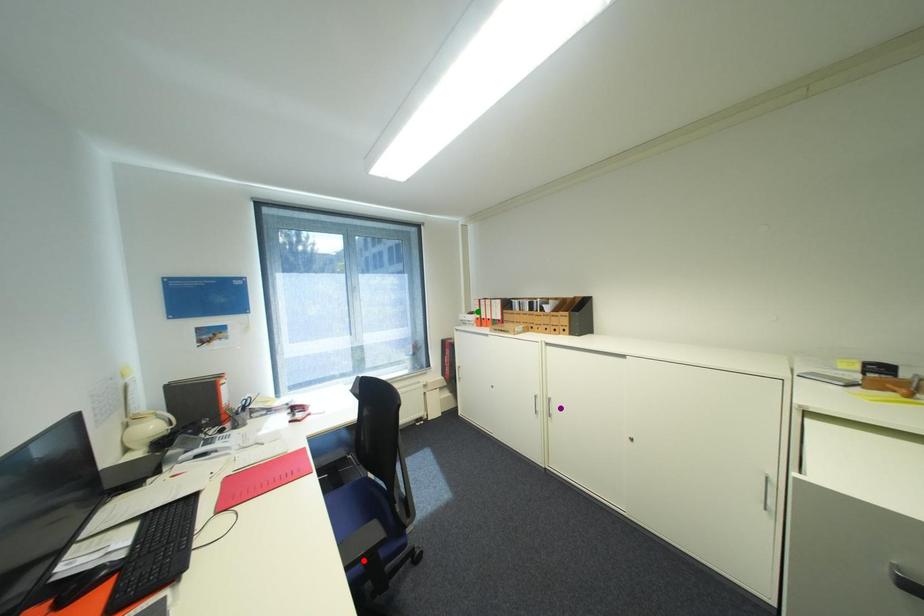
Order these from nearest to farthest:
red point | purple point | green point

red point < purple point < green point